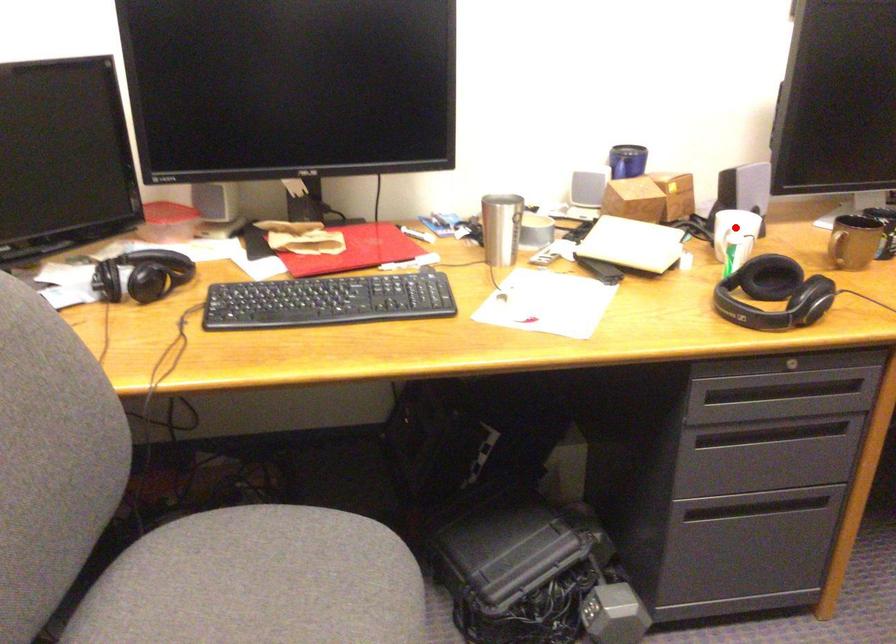
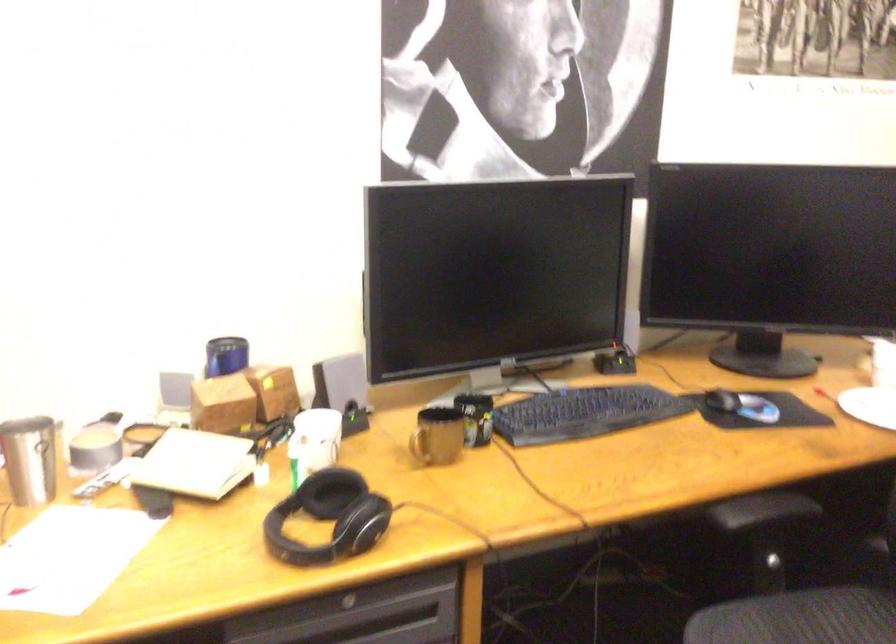
Find the pixel in the second image that matches the highlighted location in the first image.

(314, 440)